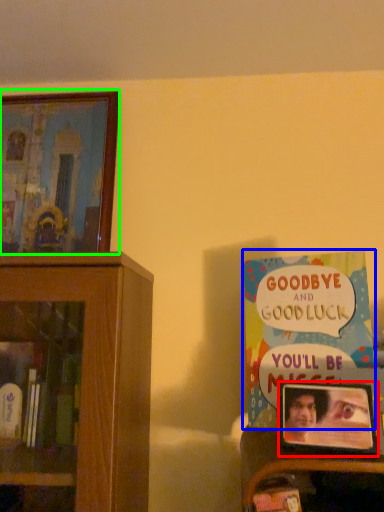
Question: Considering the real-world distances, which object is closest to picture frame (highlighted by a red box)? book (highlighted by a blue box) or picture frame (highlighted by a green box).

Choices:
 (A) book
 (B) picture frame

Answer: (A)